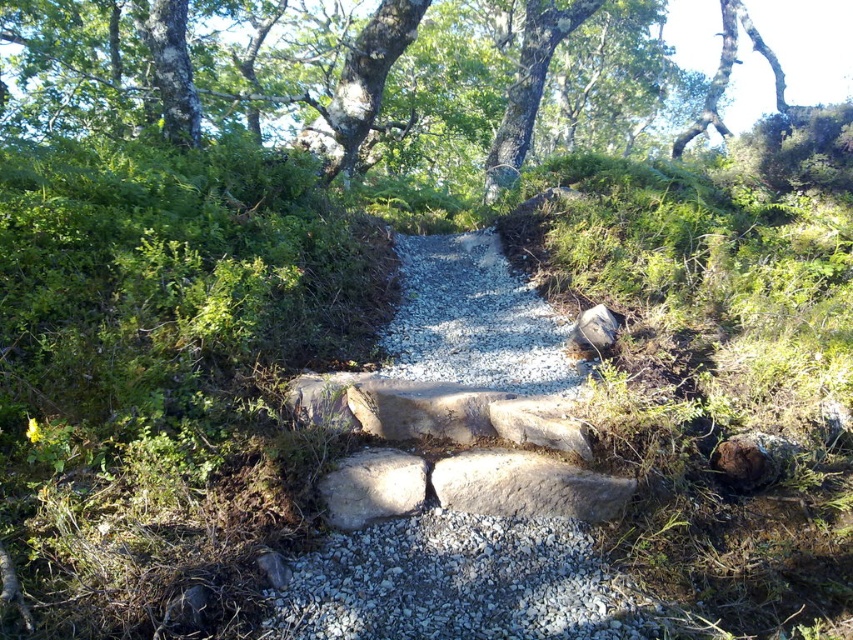
Between gray gravel at center and gray rough stone at center, which one appears on the right side from the viewer's perspective?

From the viewer's perspective, gray gravel at center appears more on the right side.

The height and width of the screenshot is (640, 853). Find the location of `gray gravel at center`. gray gravel at center is located at coordinates (454, 582).

Does gray gravel at center have a greater height compared to smooth gray rock at center-right?

Incorrect, gray gravel at center's height is not larger of smooth gray rock at center-right's.

Who is positioned more to the left, gray gravel at center or smooth gray rock at center-right?

gray gravel at center is more to the left.

Does point (506, 589) come farther from viewer compared to point (575, 330)?

No.

Locate an element on the screen. The width and height of the screenshot is (853, 640). gray gravel at center is located at coordinates (454, 582).

Does gray rough stone at center appear on the right side of smooth gray rock at center-right?

In fact, gray rough stone at center is to the left of smooth gray rock at center-right.

Does point (398, 449) come in front of point (589, 348)?

That is True.

Is point (344, 508) farther from viewer compared to point (614, 324)?

No, (344, 508) is closer to viewer.

At what (x,y) coordinates should I click in order to perform the action: click on gray rough stone at center. Please return your answer as a coordinate pair (x, y). Looking at the image, I should click on (372, 486).